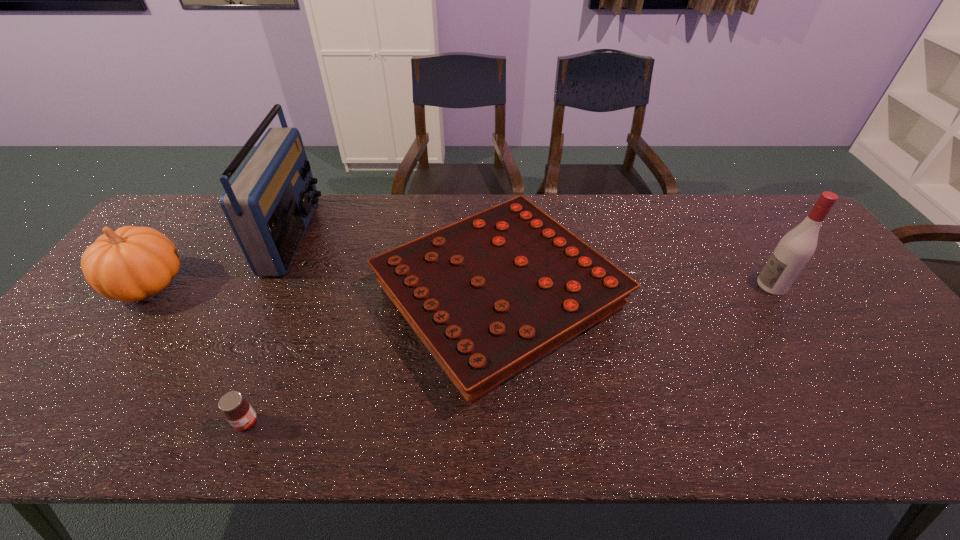
The height and width of the screenshot is (540, 960). I want to click on empty space that is in between the third tallest object and the radio receiver, so click(221, 260).

Where is `empty location between the third object from left to right and the fourth object from right to left`? Image resolution: width=960 pixels, height=540 pixels. empty location between the third object from left to right and the fourth object from right to left is located at coordinates (270, 329).

In order to click on vacant space that's between the third tallest object and the second object from left to right in this screenshot , I will do `click(221, 260)`.

You are a GUI agent. You are given a task and a screenshot of the screen. Output one action in this format:
    pyautogui.click(x=<x>, y=<y>)
    Task: Click on the unoccupied position between the alcohol and the gameboard
    
    Given the screenshot: What is the action you would take?
    pyautogui.click(x=636, y=291)

I want to click on empty space between the gameboard and the alcohol, so click(x=636, y=291).

This screenshot has width=960, height=540. In order to click on vacant region between the leftmost object and the gameboard in this screenshot , I will do `click(324, 291)`.

Identify which object is located as the fourth nearest to the third object from left to right. Please provide its 2D coordinates. Your answer should be formatted as a tuple, i.e. [(x, y)], where the tuple contains the x and y coordinates of a point satisfying the conditions above.

[(794, 250)]

Locate which object ranks in proximity to the jam. Please provide its 2D coordinates. Your answer should be formatted as a tuple, i.e. [(x, y)], where the tuple contains the x and y coordinates of a point satisfying the conditions above.

[(489, 295)]

This screenshot has height=540, width=960. In order to click on free location that satisfies the following two spatial constraints: 1. on the front panel of the gameboard; 2. on the left side of the radio receiver in this screenshot , I will do `click(265, 296)`.

The width and height of the screenshot is (960, 540). I want to click on free space that satisfies the following two spatial constraints: 1. on the front panel of the second object from left to right; 2. on the right side of the fourth object from left to right, so click(x=265, y=296).